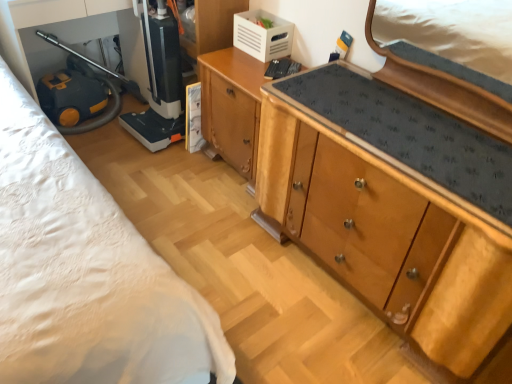
Question: Considering the relative positions of wooden cabinet at center, arranged as the 1th cabinetry when viewed from the left, and wooden cabinet at center, placed as the 2th cabinetry when sorted from left to right, in the image provided, is wooden cabinet at center, arranged as the 1th cabinetry when viewed from the left, to the left or to the right of wooden cabinet at center, placed as the 2th cabinetry when sorted from left to right,?

Choices:
 (A) left
 (B) right

Answer: (A)

Question: Is wooden cabinet at center, arranged as the 2th cabinetry when viewed from the right, wider or thinner than wooden cabinet at center, which appears as the 1th cabinetry when viewed from the right?

Choices:
 (A) wide
 (B) thin

Answer: (B)

Question: Which is farther from the white plastic crate at upper center, which is counted as the 2th appliance, starting from the left?

Choices:
 (A) wooden cabinet at center, which appears as the 1th cabinetry when viewed from the right
 (B) wooden cabinet at center, arranged as the 2th cabinetry when viewed from the right
 (C) black plastic vacuum cleaner at lower left, the 2th appliance in the right-to-left sequence

Answer: (A)

Question: Which object is positioned closest to the black plastic vacuum cleaner at lower left, acting as the 1th appliance starting from the left?

Choices:
 (A) wooden cabinet at center, which appears as the 1th cabinetry when viewed from the right
 (B) wooden cabinet at center, arranged as the 2th cabinetry when viewed from the right
 (C) white plastic crate at upper center, which is counted as the 2th appliance, starting from the left

Answer: (B)